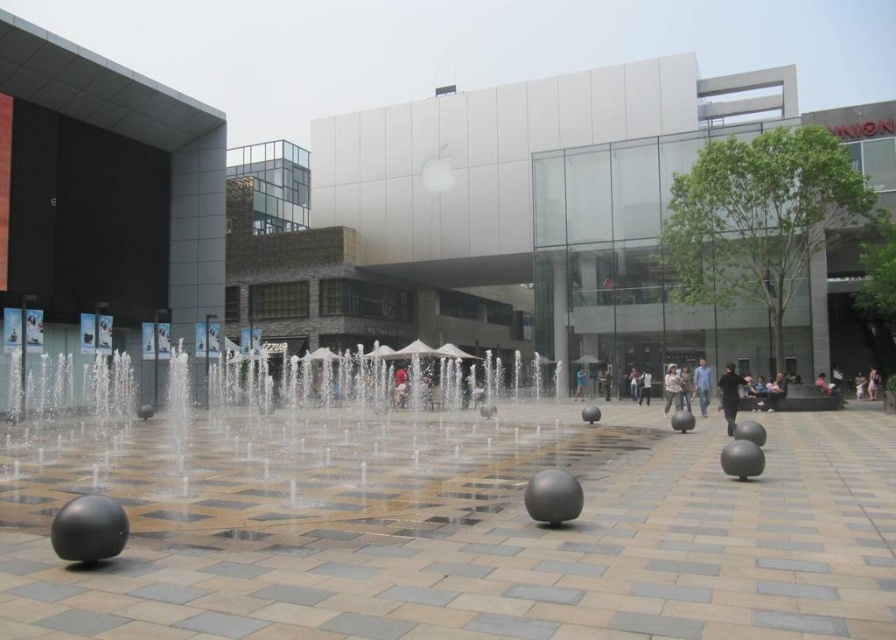
Can you confirm if light skin human at center is smaller than light brown fabric bag at lower right?

Yes.

Can you confirm if light skin human at center is taller than light brown fabric bag at lower right?

Correct, light skin human at center is much taller as light brown fabric bag at lower right.

Identify the location of light skin human at center. Image resolution: width=896 pixels, height=640 pixels. (643, 387).

Is black matte person at center to the right of light brown fabric bag at lower right from the viewer's perspective?

Incorrect, black matte person at center is not on the right side of light brown fabric bag at lower right.

Can you confirm if black matte person at center is wider than light brown fabric bag at lower right?

Yes, black matte person at center is wider than light brown fabric bag at lower right.

This screenshot has height=640, width=896. Describe the element at coordinates (729, 396) in the screenshot. I see `black matte person at center` at that location.

Identify the location of black matte person at center. The height and width of the screenshot is (640, 896). (729, 396).

Consider the image. Can you confirm if matte white building at center is bigger than light skin human at center?

Indeed, matte white building at center has a larger size compared to light skin human at center.

Can you confirm if matte white building at center is thinner than light skin human at center?

Incorrect, matte white building at center's width is not less than light skin human at center's.

Who is more distant from viewer, (806,305) or (639,381)?

The point (639,381) is more distant.

You are a GUI agent. You are given a task and a screenshot of the screen. Output one action in this format:
    pyautogui.click(x=<x>, y=<y>)
    Task: Click on the matte white building at center
    
    Given the screenshot: What is the action you would take?
    pyautogui.click(x=554, y=188)